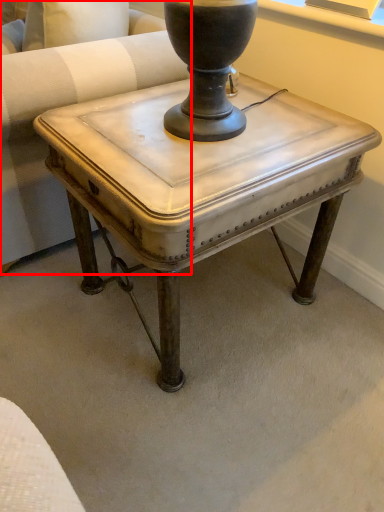
Question: From the image's perspective, where is swivel chair (annotated by the red box) located in relation to table in the image?

Choices:
 (A) above
 (B) below

Answer: (A)